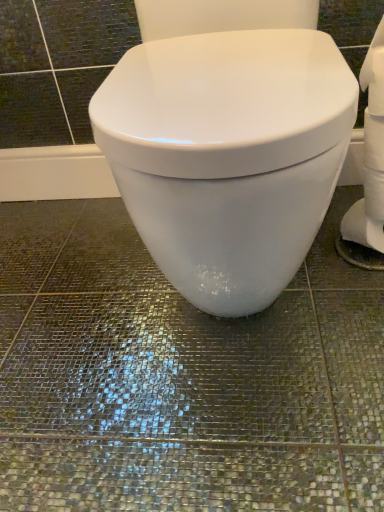
The image size is (384, 512). What do you see at coordinates (228, 155) in the screenshot?
I see `white glossy toilet at center` at bounding box center [228, 155].

Measure the distance between point (314, 170) and camera.

A distance of 20.20 inches exists between point (314, 170) and camera.

You are a GUI agent. You are given a task and a screenshot of the screen. Output one action in this format:
    pyautogui.click(x=<x>, y=<y>)
    Task: Click on the white glossy toilet at center
    
    Given the screenshot: What is the action you would take?
    pyautogui.click(x=228, y=155)

Image resolution: width=384 pixels, height=512 pixels. What do you see at coordinates (371, 154) in the screenshot?
I see `white matte toilet paper at right` at bounding box center [371, 154].

The height and width of the screenshot is (512, 384). In order to click on white matte toilet paper at right in this screenshot , I will do `click(371, 154)`.

Where is `white glossy toilet at center`? The image size is (384, 512). white glossy toilet at center is located at coordinates (228, 155).

Considering the relative positions of white matte toilet paper at right and white glossy toilet at center in the image provided, is white matte toilet paper at right to the right of white glossy toilet at center from the viewer's perspective?

Indeed, white matte toilet paper at right is positioned on the right side of white glossy toilet at center.

Who is more distant, white matte toilet paper at right or white glossy toilet at center?

white matte toilet paper at right is more distant.

Which is closer, (350, 227) or (304, 203)?

Clearly, point (350, 227) is more distant from the camera than point (304, 203).

From the image's perspective, is white matte toilet paper at right on top of white glossy toilet at center?

Incorrect, from the image's perspective, white matte toilet paper at right is lower than white glossy toilet at center.

From a real-world perspective, who is located higher, white matte toilet paper at right or white glossy toilet at center?

white glossy toilet at center is physically above.

Can you confirm if white matte toilet paper at right is wider than white glossy toilet at center?

No.

Considering the sizes of objects white matte toilet paper at right and white glossy toilet at center in the image provided, who is shorter, white matte toilet paper at right or white glossy toilet at center?

white matte toilet paper at right is shorter.

Is white matte toilet paper at right smaller than white glossy toilet at center?

Correct, white matte toilet paper at right occupies less space than white glossy toilet at center.

Is white matte toilet paper at right surrounding white glossy toilet at center?

No, white matte toilet paper at right does not contain white glossy toilet at center.

Are white matte toilet paper at right and white glossy toilet at center located far from each other?

No, there isn't a large distance between white matte toilet paper at right and white glossy toilet at center.

Could you tell me if white matte toilet paper at right is facing white glossy toilet at center?

Yes, white matte toilet paper at right is oriented towards white glossy toilet at center.

Can you tell me how much white matte toilet paper at right and white glossy toilet at center differ in facing direction?

There is a 88.9-degree angle between the facing directions of white matte toilet paper at right and white glossy toilet at center.

This screenshot has width=384, height=512. There is a white matte toilet paper at right. Identify the location of toilet above it (from a real-world perspective). pos(228,155).

Based on the photo, is white glossy toilet at center at the left side of white matte toilet paper at right?

Yes, white glossy toilet at center is to the left of white matte toilet paper at right.

Is white glossy toilet at center further to camera compared to white matte toilet paper at right?

No, white glossy toilet at center is closer to the viewer.

Which is further, (315, 208) or (377, 161)?

The point (377, 161) is more distant.

From the image's perspective, which is above, white glossy toilet at center or white matte toilet paper at right?

white glossy toilet at center is shown above in the image.

From a real-world perspective, who is located lower, white glossy toilet at center or white matte toilet paper at right?

white matte toilet paper at right.

Can you confirm if white glossy toilet at center is thinner than white matte toilet paper at right?

No.

Who is shorter, white glossy toilet at center or white matte toilet paper at right?

white matte toilet paper at right is shorter.

Who is bigger, white glossy toilet at center or white matte toilet paper at right?

Bigger between the two is white glossy toilet at center.

Is white matte toilet paper at right a part of white glossy toilet at center?

No, white matte toilet paper at right is not a part of white glossy toilet at center.

From the picture: Are white glossy toilet at center and white matte toilet paper at right making contact?

→ There is a gap between white glossy toilet at center and white matte toilet paper at right.

Is white glossy toilet at center facing away from white matte toilet paper at right?

No.

What's the angular difference between white glossy toilet at center and white matte toilet paper at right's facing directions?

The angular difference between white glossy toilet at center and white matte toilet paper at right is 88.9 degrees.

Where is `toilet paper below the white glossy toilet at center (from a real-world perspective)`? Image resolution: width=384 pixels, height=512 pixels. toilet paper below the white glossy toilet at center (from a real-world perspective) is located at coordinates (371, 154).

Identify the location of toilet that appears above the white matte toilet paper at right (from a real-world perspective). This screenshot has width=384, height=512. (228, 155).

Where is `toilet in front of the white matte toilet paper at right`? Image resolution: width=384 pixels, height=512 pixels. toilet in front of the white matte toilet paper at right is located at coordinates (228, 155).